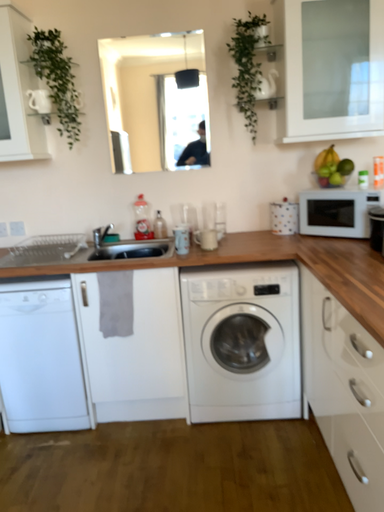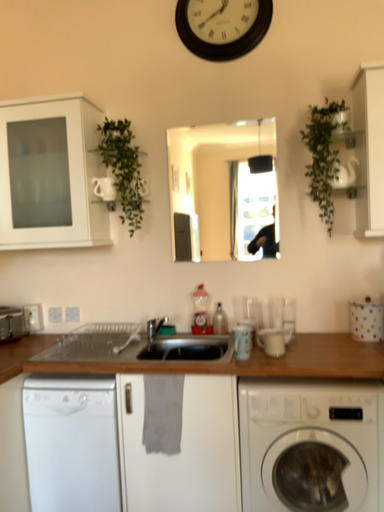
Question: Which way did the camera rotate in the video?

Choices:
 (A) rotated left
 (B) rotated right

Answer: (A)